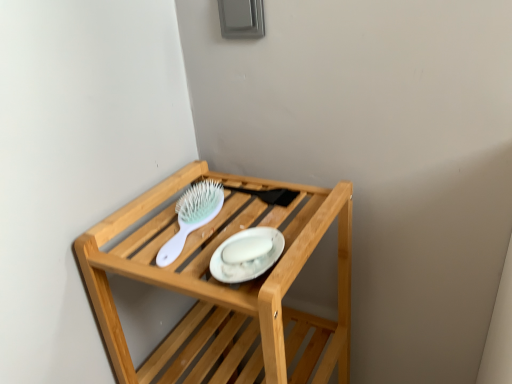
I want to click on vacant space that is in between white plastic brush at upper center and white glossy platter at center, so click(221, 240).